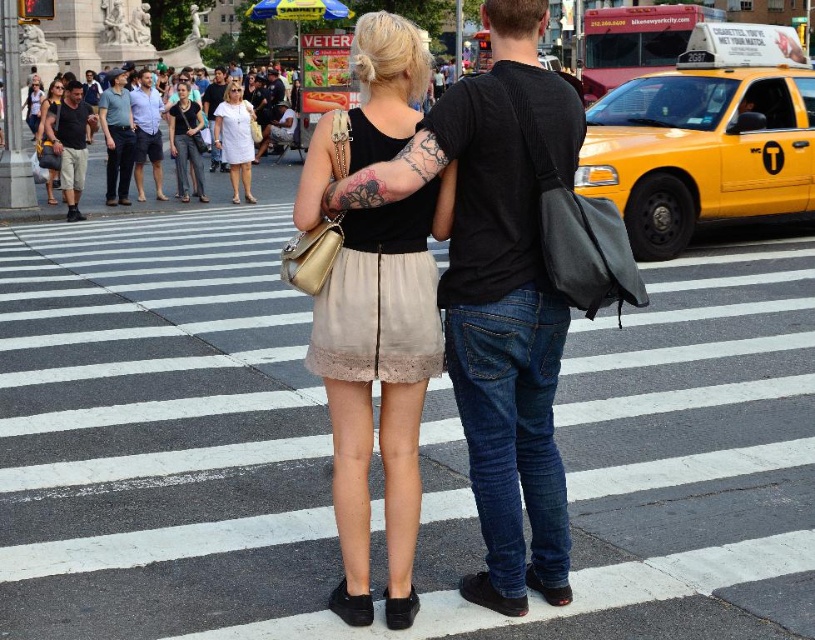
Question: Does matte black tank top at center have a smaller size compared to light blue denim shorts at center?

Choices:
 (A) yes
 (B) no

Answer: (B)

Question: Can you confirm if dark blue jeans at center is bigger than light blue denim shorts at center?

Choices:
 (A) no
 (B) yes

Answer: (B)

Question: Among these objects, which one is farthest from the camera?

Choices:
 (A) yellow matte taxi at right
 (B) dark blue jeans at center
 (C) white matte dress at center

Answer: (C)

Question: Which of the following is the closest to the observer?

Choices:
 (A) matte black shirt at center
 (B) light blue denim shorts at center
 (C) white cotton dress at center
 (D) white matte dress at center

Answer: (C)

Question: Which object appears closest to the camera in this image?

Choices:
 (A) dark blue jeans at center
 (B) white cotton dress at center
 (C) white matte dress at center

Answer: (B)

Question: From the image, what is the correct spatial relationship of matte black tank top at center in relation to light blue denim shorts at center?

Choices:
 (A) right
 (B) left

Answer: (A)